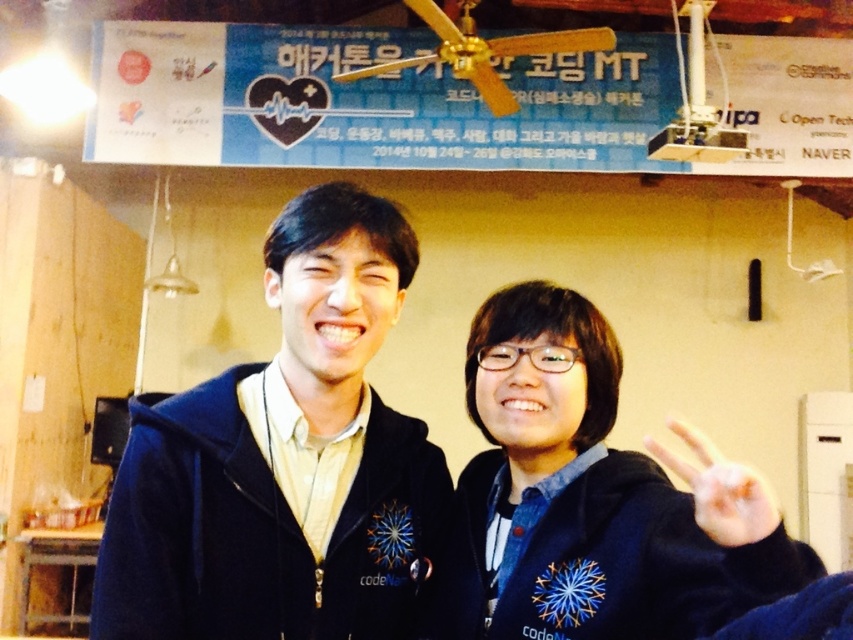
You are a photographer at a conference and need to adjust the lighting to ensure both the navy blue hoodie at center and the matte black hoodie at center are well lit. Considering their sizes, which hoodie might require more focused lighting adjustments?

The navy blue hoodie at center has a greater height compared to the matte black hoodie at center, so it might require more focused lighting adjustments due to its larger size.

You are a photographer at the event. You want to adjust the lighting so that the matte black hoodie at center and the white matte hand at center right are both well lit. Since the hand is closer to the light source, which object should you adjust the light intensity for more?

The matte black hoodie at center should have its light intensity adjusted more because it is farther from the light source than the white matte hand at center right.